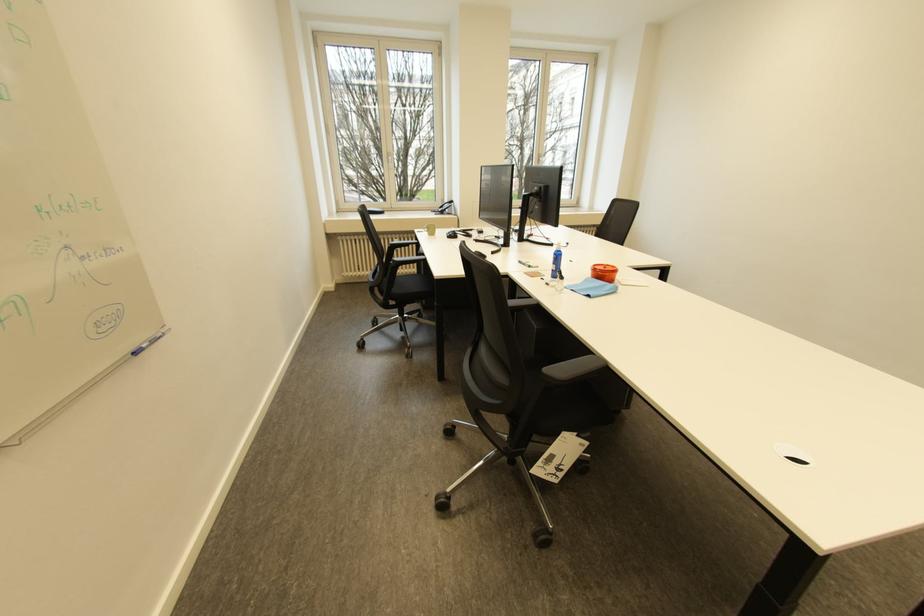
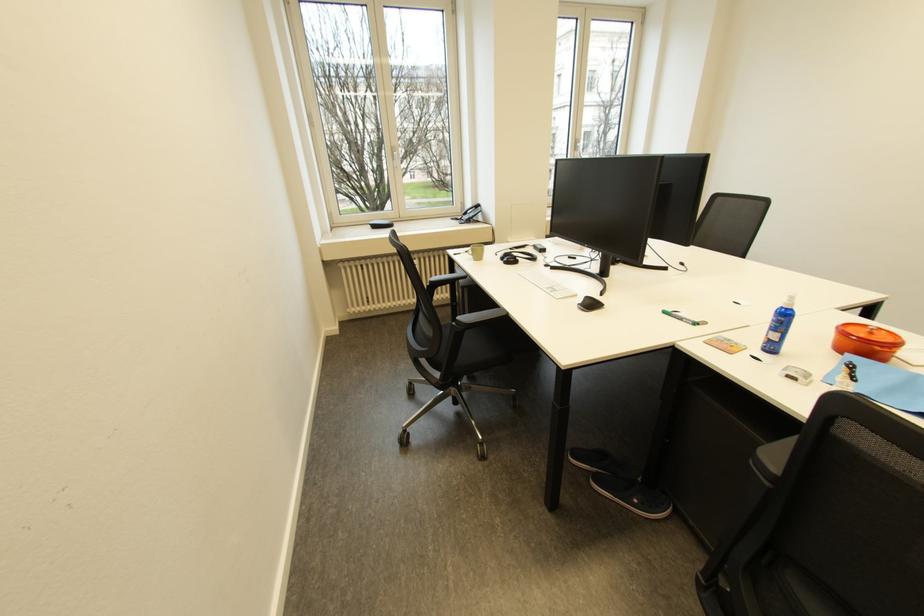
The images are taken continuously from a first-person perspective. In which direction are you moving?

The movement direction of the cameraman is left, forward.